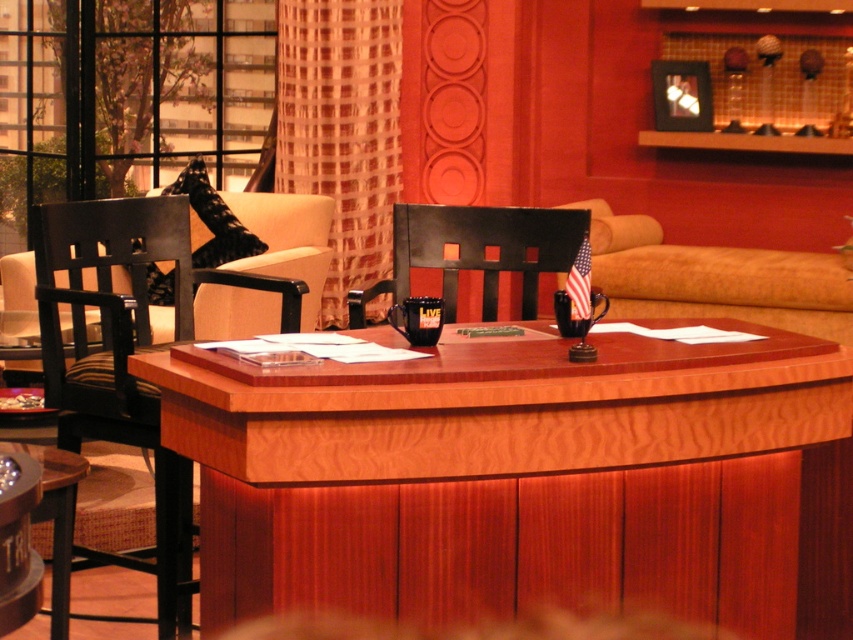
You are a stagehand setting up for a live show. You need to move a large equipment box that requires a space wider than the black wood chair at left. Can the wooden table at lower left accommodate it?

The black wood chair at left might be wider than wooden table at lower left, so the wooden table at lower left may not be wide enough to accommodate the large equipment box if it needs more space than the chair.

You are standing in the studio and want to place a small plant between the two points, point (277, 484) and point (65, 625). Which point should the plant be closer to in order to be nearer to the front of the studio?

The plant should be placed closer to point (277, 484) because it is closer to the viewer than point (65, 625).